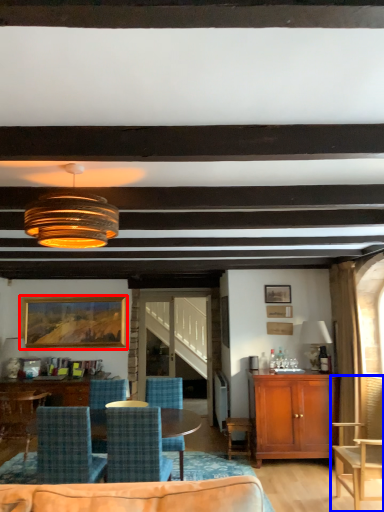
Question: Which of the following is the closest to the observer, picture frame (highlighted by a red box) or chair (highlighted by a blue box)?

Choices:
 (A) picture frame
 (B) chair

Answer: (B)